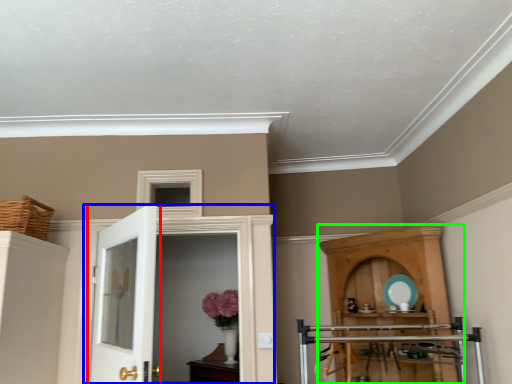
Question: Which is nearer to the door (highlighted by a red box)? door (highlighted by a blue box) or cupboard (highlighted by a green box).

Choices:
 (A) door
 (B) cupboard

Answer: (A)